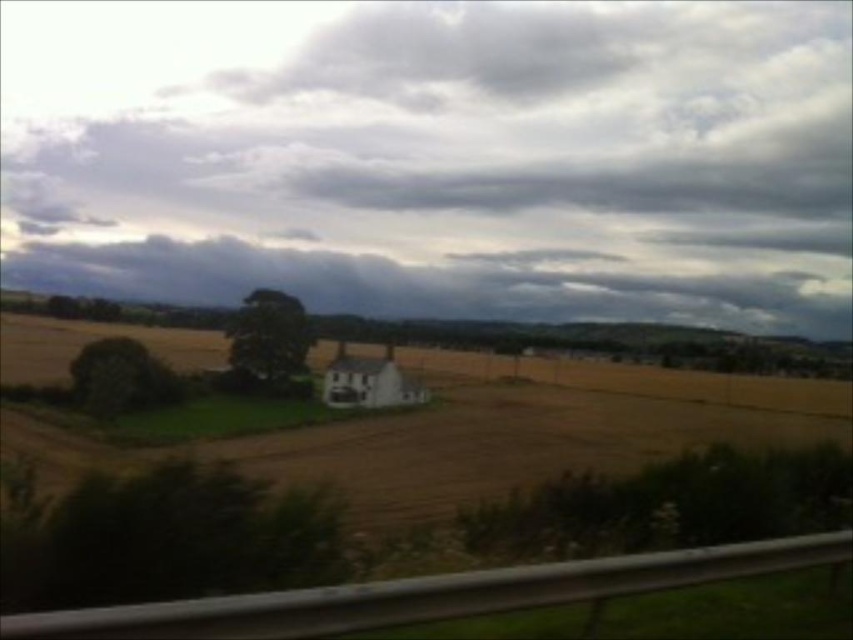
Question: Which point is closer to the camera?

Choices:
 (A) green leafy tree at left
 (B) green leafy tree at lower left
 (C) golden matte wheat field at center

Answer: (B)

Question: Which point appears closest to the camera in this image?

Choices:
 (A) (308, 346)
 (B) (97, 416)
 (C) (125, 35)
 (D) (310, 560)

Answer: (D)

Question: Is green leafy tree at lower left to the left of green leafy tree at center from the viewer's perspective?

Choices:
 (A) no
 (B) yes

Answer: (A)

Question: Is green leafy tree at lower left behind green leafy tree at center?

Choices:
 (A) no
 (B) yes

Answer: (A)

Question: Can you confirm if cloudy sky at upper center is positioned to the left of green leafy tree at lower left?

Choices:
 (A) no
 (B) yes

Answer: (B)

Question: Considering the real-world distances, which object is farthest from the green leafy tree at center?

Choices:
 (A) cloudy sky at upper center
 (B) golden matte wheat field at center

Answer: (A)